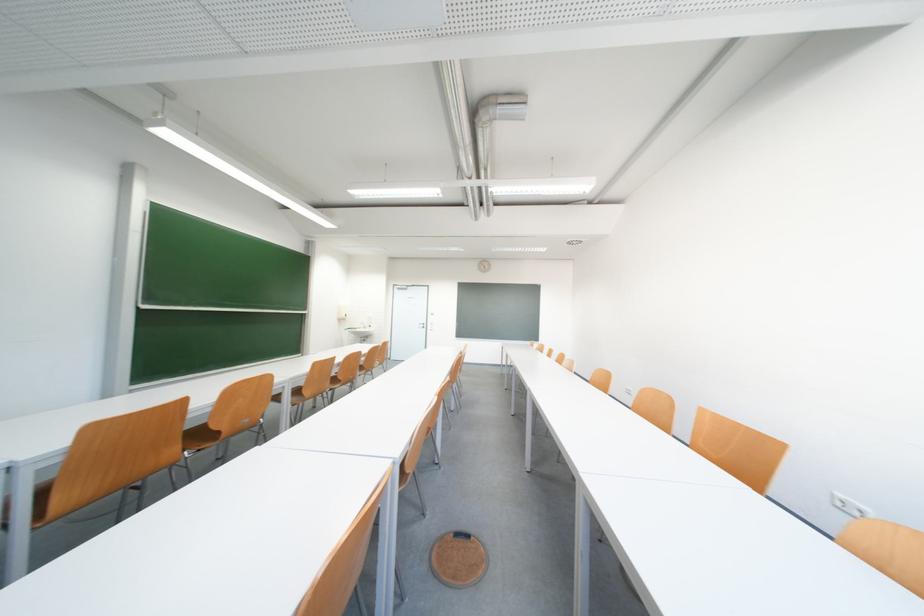
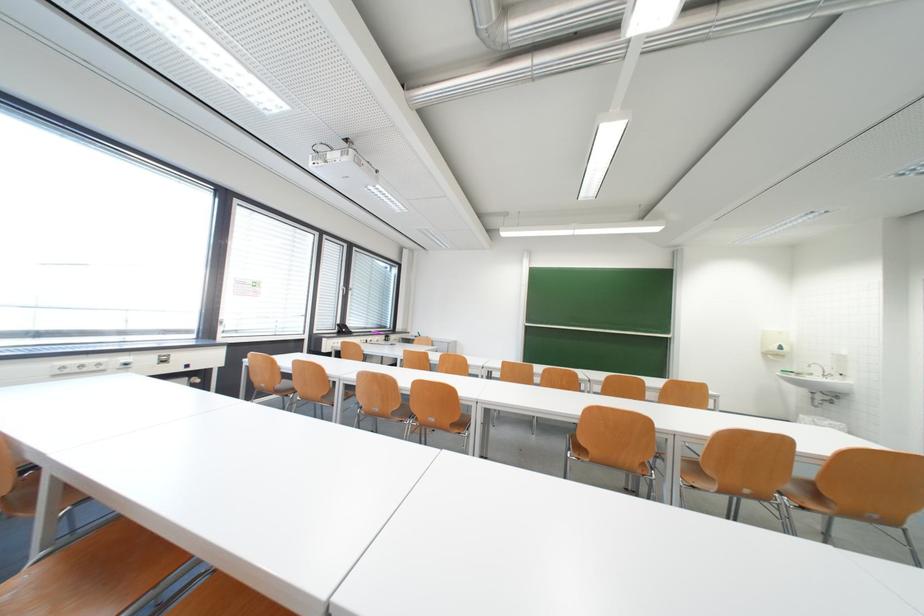
In the second image, find the point that corresponds to pixel 349 322 in the first image.

(784, 357)